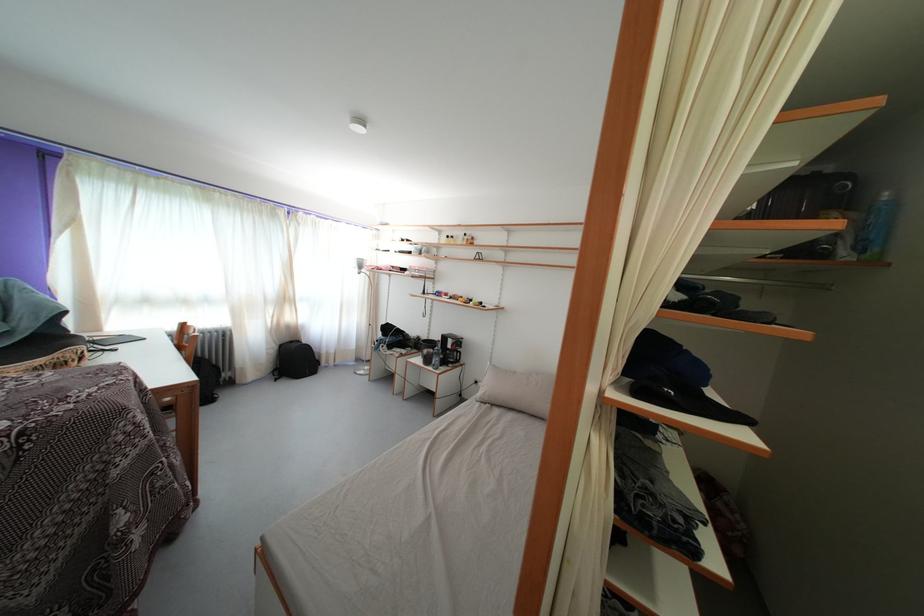
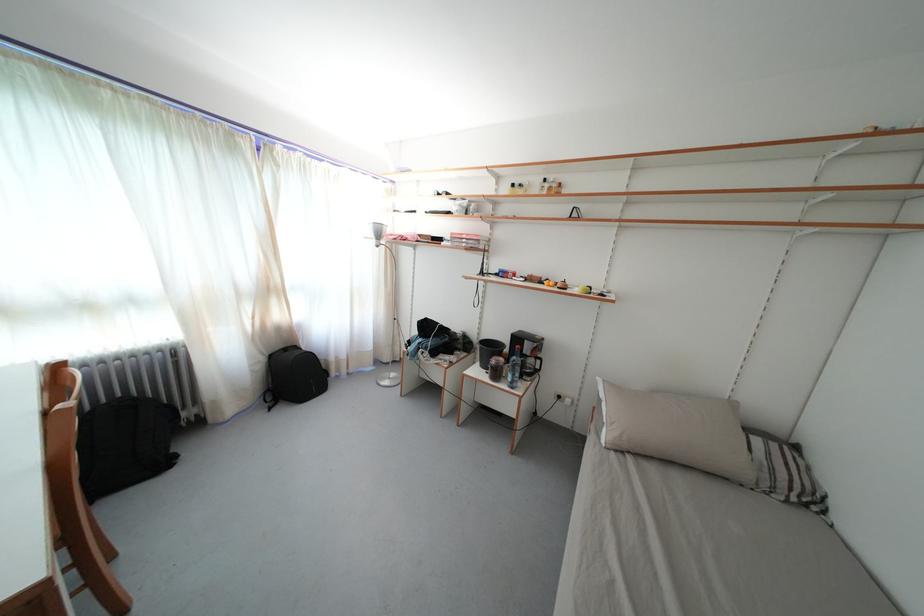
The point at [223,373] is marked in the first image. Where is the corresponding point in the second image?

(175, 411)